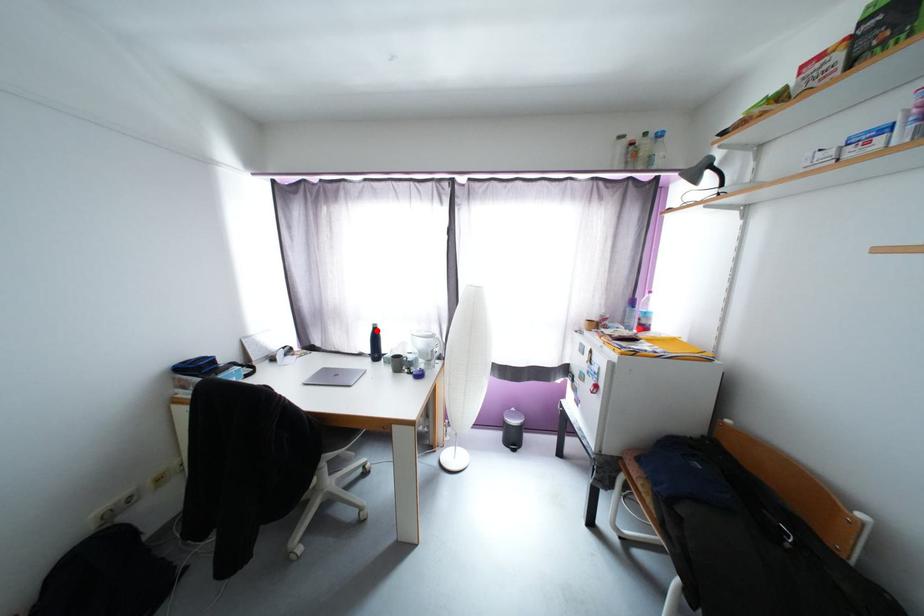
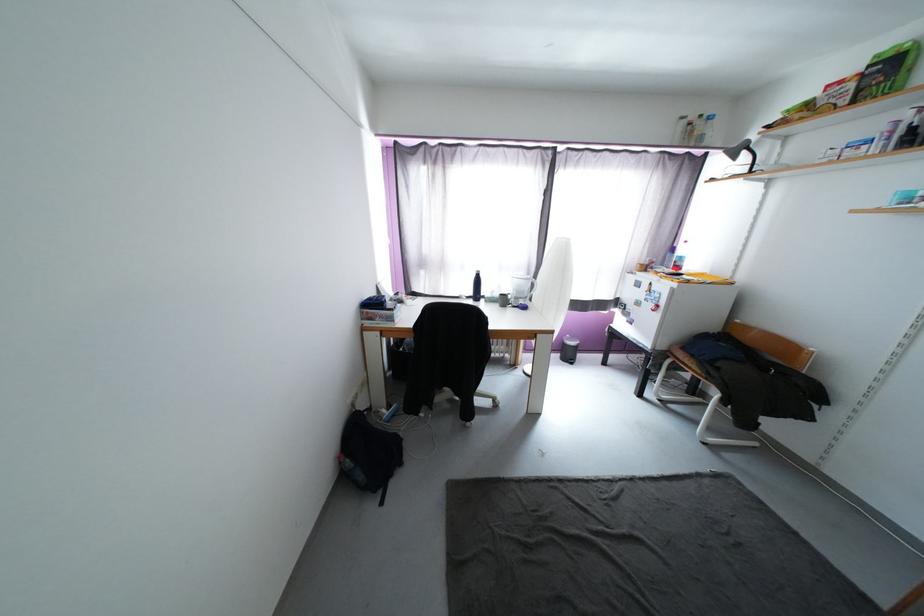
Question: I am providing you with two images of the same scene from different viewpoints. A red point is marked on the first image. At the location where the point appears in image 1, is it still visible in image 2?

Choices:
 (A) Yes
 (B) No

Answer: (A)